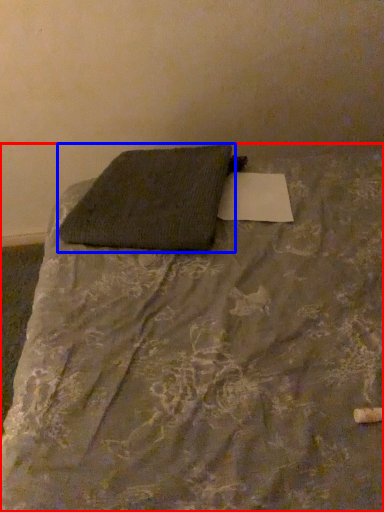
Question: Which point is further to the camera, bed (highlighted by a red box) or pillow (highlighted by a blue box)?

Choices:
 (A) bed
 (B) pillow

Answer: (B)